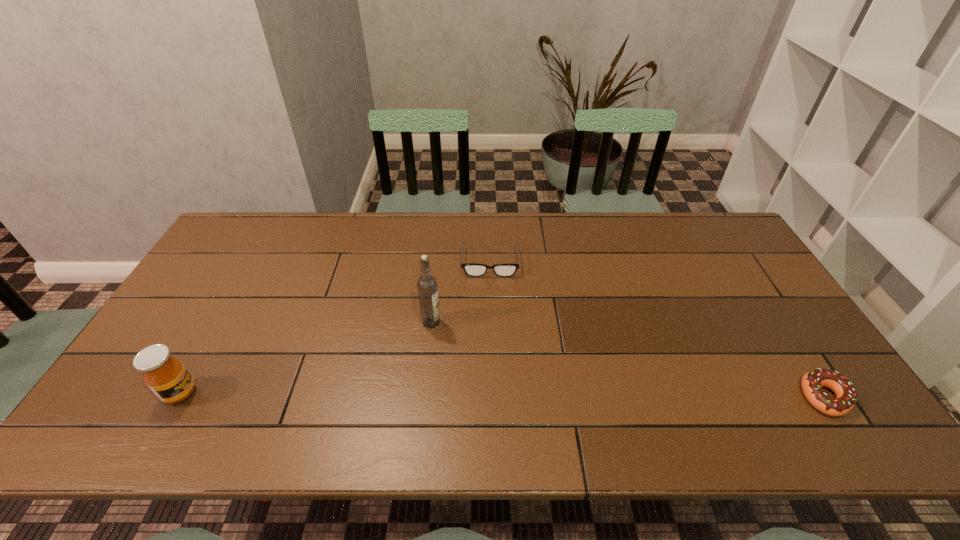
The image size is (960, 540). I want to click on object that is positioned at the near left corner, so click(x=167, y=377).

At what (x,y) coordinates should I click in order to perform the action: click on object located in the near right corner section of the desktop. Please return your answer as a coordinate pair (x, y). Image resolution: width=960 pixels, height=540 pixels. Looking at the image, I should click on (812, 382).

Where is `free space at the far edge`? Image resolution: width=960 pixels, height=540 pixels. free space at the far edge is located at coordinates (650, 225).

Find the location of a particular element. Image resolution: width=960 pixels, height=540 pixels. blank area at the near edge is located at coordinates (418, 386).

In the image, there is a desktop. Where is `vacant region at the left edge`? vacant region at the left edge is located at coordinates (260, 259).

Identify the location of vacant space at the far right corner. The width and height of the screenshot is (960, 540). (704, 233).

Locate an element on the screen. free point between the farthest object and the second farthest object is located at coordinates (461, 292).

I want to click on free point between the spectacles and the tallest object, so click(461, 292).

Where is `vacant area that lies between the second object from right to left and the third shortest object`? The height and width of the screenshot is (540, 960). vacant area that lies between the second object from right to left and the third shortest object is located at coordinates (335, 327).

Locate an element on the screen. The height and width of the screenshot is (540, 960). free space between the spectacles and the second tallest object is located at coordinates (335, 327).